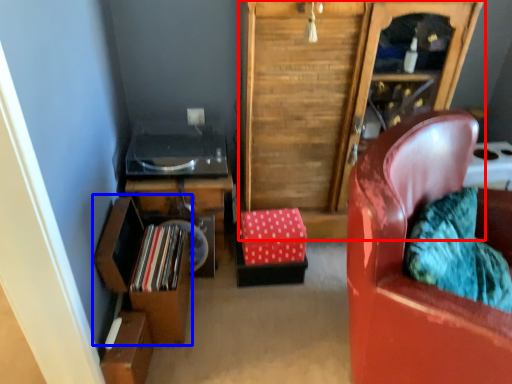
Question: Which object is closer to the camera taking this photo, cabinetry (highlighted by a red box) or shelf (highlighted by a blue box)?

Choices:
 (A) cabinetry
 (B) shelf

Answer: (A)